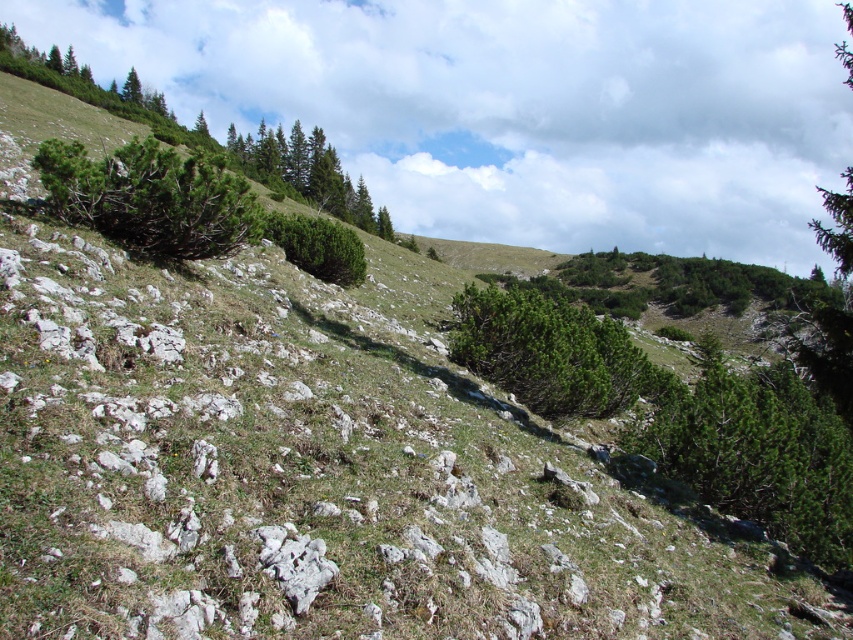
You are a hiker planning to set up a tent between the green textured pine tree at upper right and the green matte tree at upper left. Which tree has a wider trunk to ensure the tent is placed on the sturdier side?

The green textured pine tree at upper right has a wider trunk than the green matte tree at upper left, so placing the tent near it would be sturdier.

You are a hiker standing at the base of the mountain. You see the green matte tree at upper center and the green textured pine tree at upper right. Which tree is farther away from you?

The green textured pine tree at upper right is farther away from you because the distance between the green matte tree at upper center and the green textured pine tree at upper right is 289.81 meters, implying that the pine tree is further back along the slope.